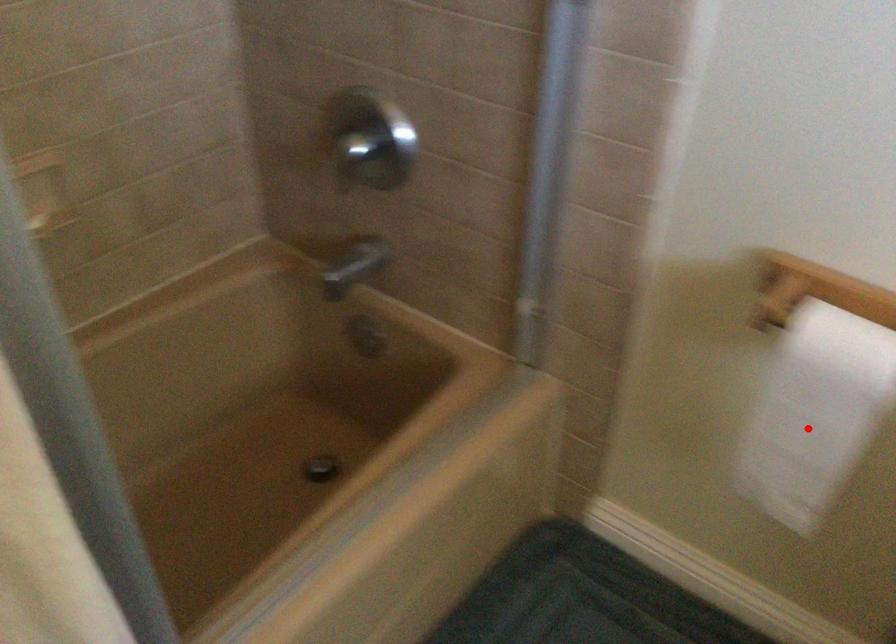
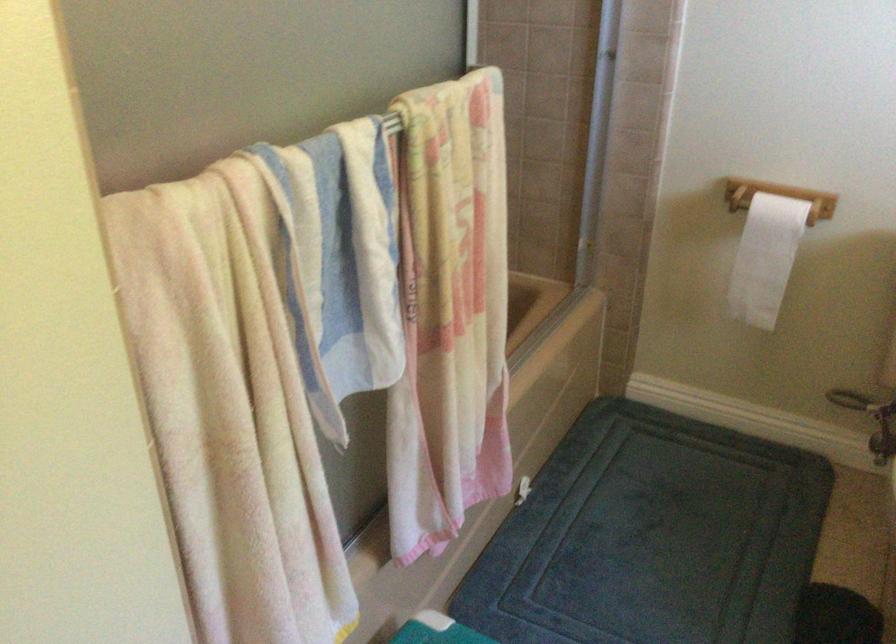
Find the pixel in the second image that matches the highlighted location in the first image.

(764, 258)